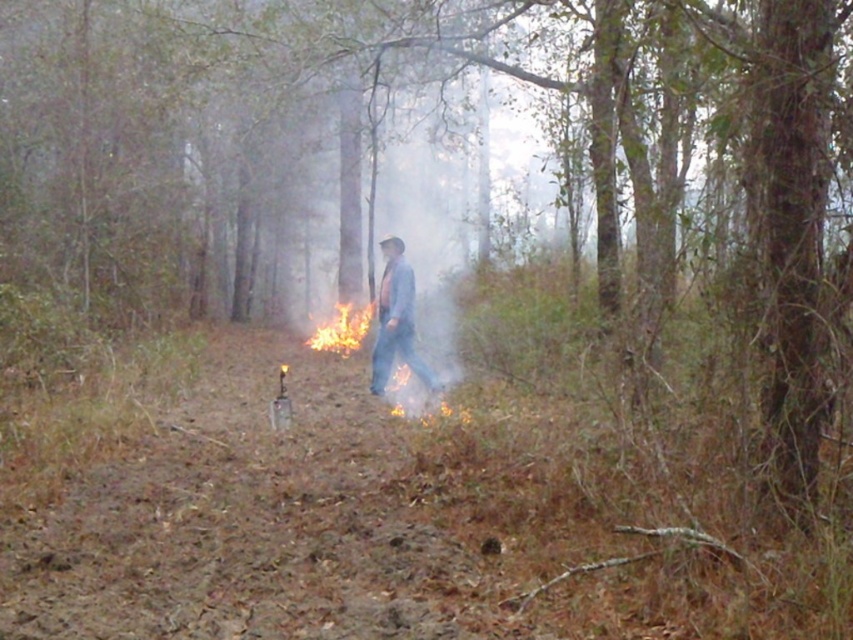
Looking at this image, can you confirm if blue denim jeans at center is bigger than flame/yellow-orange at center?

Incorrect, blue denim jeans at center is not larger than flame/yellow-orange at center.

Which is above, blue denim jeans at center or flame/yellow-orange at center?

blue denim jeans at center is higher up.

Between point (383, 273) and point (364, 320), which one is positioned in front?

Point (383, 273) is more forward.

This screenshot has height=640, width=853. What are the coordinates of `blue denim jeans at center` in the screenshot? It's located at (396, 321).